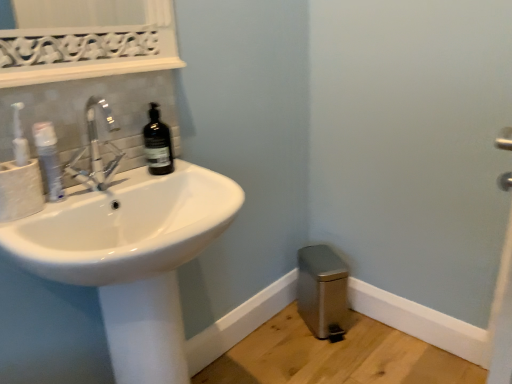
What are the coordinates of `white glossy mouthwash at left` in the screenshot? It's located at (49, 160).

What do you see at coordinates (49, 160) in the screenshot? I see `white glossy mouthwash at left` at bounding box center [49, 160].

Identify the location of white glossy sink at left. The width and height of the screenshot is (512, 384). (131, 257).

From a real-world perspective, is matte white toilet paper at left on black glass bottle at upper left?

No, from a real-world perspective, matte white toilet paper at left is not on top of black glass bottle at upper left.

How many degrees apart are the facing directions of matte white toilet paper at left and black glass bottle at upper left?

The angular difference between matte white toilet paper at left and black glass bottle at upper left is 0.00209 degrees.

Is matte white toilet paper at left in front of or behind black glass bottle at upper left in the image?

Visually, matte white toilet paper at left is located in front of black glass bottle at upper left.

Where is `toilet paper below the black glass bottle at upper left (from the image's perspective)`? The width and height of the screenshot is (512, 384). toilet paper below the black glass bottle at upper left (from the image's perspective) is located at coordinates tap(20, 190).

From a real-world perspective, is black glass bottle at upper left positioned over white glossy mouthwash at left based on gravity?

Yes.

Which is behind, black glass bottle at upper left or white glossy mouthwash at left?

black glass bottle at upper left is behind.

Is point (169, 145) positioned in front of point (53, 145)?

No, it is not.

Can you confirm if black glass bottle at upper left is positioned to the right of white glossy mouthwash at left?

Indeed, black glass bottle at upper left is positioned on the right side of white glossy mouthwash at left.

How far apart are white glossy mouthwash at left and satin silver trash can at lower right?

A distance of 1.13 meters exists between white glossy mouthwash at left and satin silver trash can at lower right.

Is point (42, 134) behind point (303, 299)?

No, (42, 134) is closer to viewer.

Identify the location of bidet located underneath the white glossy mouthwash at left (from a real-world perspective). (322, 289).

Considering the sizes of objects white glossy mouthwash at left and satin silver trash can at lower right in the image provided, who is wider, white glossy mouthwash at left or satin silver trash can at lower right?

satin silver trash can at lower right is wider.

From a real-world perspective, is black glass bottle at upper left physically located above or below matte white toilet paper at left?

Clearly, from a real-world perspective, black glass bottle at upper left is above matte white toilet paper at left.

Consider the image. In terms of width, does black glass bottle at upper left look wider or thinner when compared to matte white toilet paper at left?

Clearly, black glass bottle at upper left has more width compared to matte white toilet paper at left.

Is black glass bottle at upper left looking in the opposite direction of matte white toilet paper at left?

That's not correct — black glass bottle at upper left is not looking away from matte white toilet paper at left.

Can we say black glass bottle at upper left lies outside white glossy sink at left?

Indeed, black glass bottle at upper left is completely outside white glossy sink at left.

From the image's perspective, is black glass bottle at upper left below white glossy sink at left?

Incorrect, from the image's perspective, black glass bottle at upper left is higher than white glossy sink at left.

From a real-world perspective, is black glass bottle at upper left positioned over white glossy sink at left based on gravity?

Yes, from a real-world perspective, black glass bottle at upper left is over white glossy sink at left

Is point (147, 151) less distant than point (73, 188)?

No, it is not.

Which is more to the right, matte white toilet paper at left or white glossy mouthwash at left?

From the viewer's perspective, white glossy mouthwash at left appears more on the right side.

Based on the photo, considering the relative sizes of matte white toilet paper at left and white glossy mouthwash at left in the image provided, is matte white toilet paper at left shorter than white glossy mouthwash at left?

Yes.

From the image's perspective, is matte white toilet paper at left over white glossy mouthwash at left?

No.

Is matte white toilet paper at left completely or partially outside of white glossy mouthwash at left?

matte white toilet paper at left is positioned outside white glossy mouthwash at left.

I want to click on bottle located above the satin silver trash can at lower right (from the image's perspective), so click(157, 144).

In terms of size, does black glass bottle at upper left appear bigger or smaller than satin silver trash can at lower right?

Clearly, black glass bottle at upper left is smaller in size than satin silver trash can at lower right.

Can you tell me how much black glass bottle at upper left and satin silver trash can at lower right differ in facing direction?

black glass bottle at upper left and satin silver trash can at lower right are facing 24.9 degrees away from each other.

Could you tell me if black glass bottle at upper left is turned towards satin silver trash can at lower right?

No, black glass bottle at upper left is not facing towards satin silver trash can at lower right.

Locate an element on the screen. Image resolution: width=512 pixels, height=384 pixels. bottle on the right of matte white toilet paper at left is located at coordinates (157, 144).

Locate an element on the screen. bottle behind the white glossy mouthwash at left is located at coordinates (157, 144).

When comparing their distances from white glossy mouthwash at left, does matte white toilet paper at left or white glossy sink at left seem further?

The object further to white glossy mouthwash at left is white glossy sink at left.

From the image, which object appears to be farther from satin silver trash can at lower right, white glossy sink at left or black glass bottle at upper left?

Among the two, black glass bottle at upper left is located further to satin silver trash can at lower right.

From the image, which object appears to be farther from satin silver trash can at lower right, white glossy mouthwash at left or white glossy sink at left?

white glossy mouthwash at left is positioned further to the anchor satin silver trash can at lower right.

Estimate the real-world distances between objects in this image. Which object is closer to white glossy sink at left, black glass bottle at upper left or matte white toilet paper at left?

Based on the image, black glass bottle at upper left appears to be nearer to white glossy sink at left.

In the scene shown: Considering their positions, is matte white toilet paper at left positioned further to white glossy sink at left than white glossy mouthwash at left?

Among the two, white glossy mouthwash at left is located further to white glossy sink at left.

Based on their spatial positions, is black glass bottle at upper left or satin silver trash can at lower right further from white glossy sink at left?

satin silver trash can at lower right is positioned further to the anchor white glossy sink at left.

From the image, which object appears to be farther from white glossy sink at left, white glossy mouthwash at left or matte white toilet paper at left?

The object further to white glossy sink at left is white glossy mouthwash at left.

Based on their spatial positions, is white glossy sink at left or black glass bottle at upper left further from matte white toilet paper at left?

The object further to matte white toilet paper at left is black glass bottle at upper left.

You are a GUI agent. You are given a task and a screenshot of the screen. Output one action in this format:
    pyautogui.click(x=<x>, y=<y>)
    Task: Click on the bottle situated between white glossy mouthwash at left and satin silver trash can at lower right from left to right
    
    Given the screenshot: What is the action you would take?
    pyautogui.click(x=157, y=144)

Where is `mouthwash between white glossy sink at left and satin silver trash can at lower right in the front-back direction`? This screenshot has width=512, height=384. mouthwash between white glossy sink at left and satin silver trash can at lower right in the front-back direction is located at coordinates (49, 160).

Where is `toilet paper between black glass bottle at upper left and white glossy sink at left vertically`? The height and width of the screenshot is (384, 512). toilet paper between black glass bottle at upper left and white glossy sink at left vertically is located at coordinates (20, 190).

This screenshot has width=512, height=384. Identify the location of bottle between matte white toilet paper at left and satin silver trash can at lower right from left to right. (157, 144).